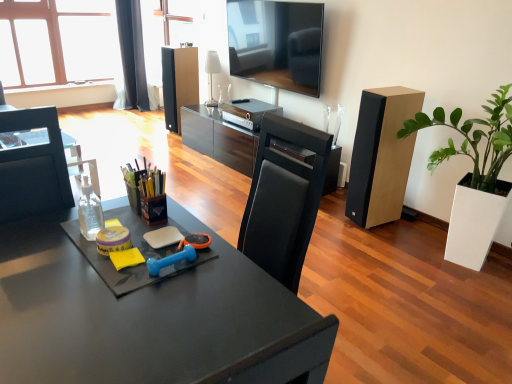
Find the location of a particular element. This screenshot has width=512, height=384. vacant space behind clear plastic bottle at left is located at coordinates [x=105, y=216].